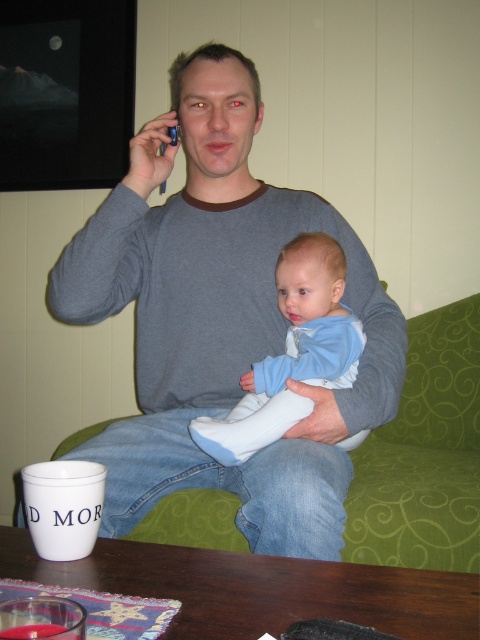
Question: Which object is farther from the camera taking this photo?

Choices:
 (A) gray cotton sweater at center
 (B) light blue fabric baby at center

Answer: (B)

Question: Where is gray cotton sweater at center located in relation to light blue fabric baby at center in the image?

Choices:
 (A) below
 (B) above

Answer: (B)

Question: Which of the following is the farthest from the observer?

Choices:
 (A) (63, 264)
 (B) (349, 337)

Answer: (B)

Question: Is gray cotton sweater at center below light blue fabric baby at center?

Choices:
 (A) yes
 (B) no

Answer: (B)

Question: Does gray cotton sweater at center have a larger size compared to light blue fabric baby at center?

Choices:
 (A) no
 (B) yes

Answer: (B)